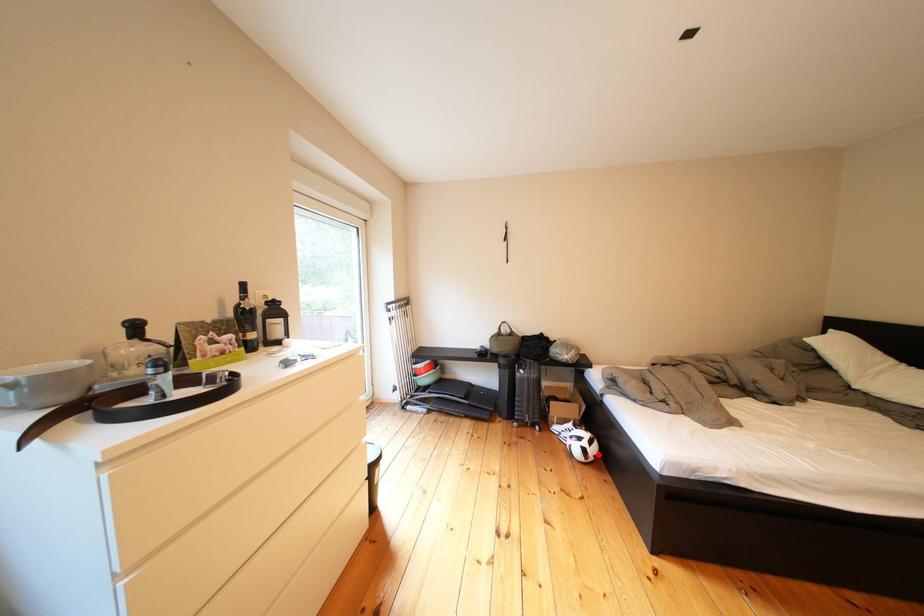
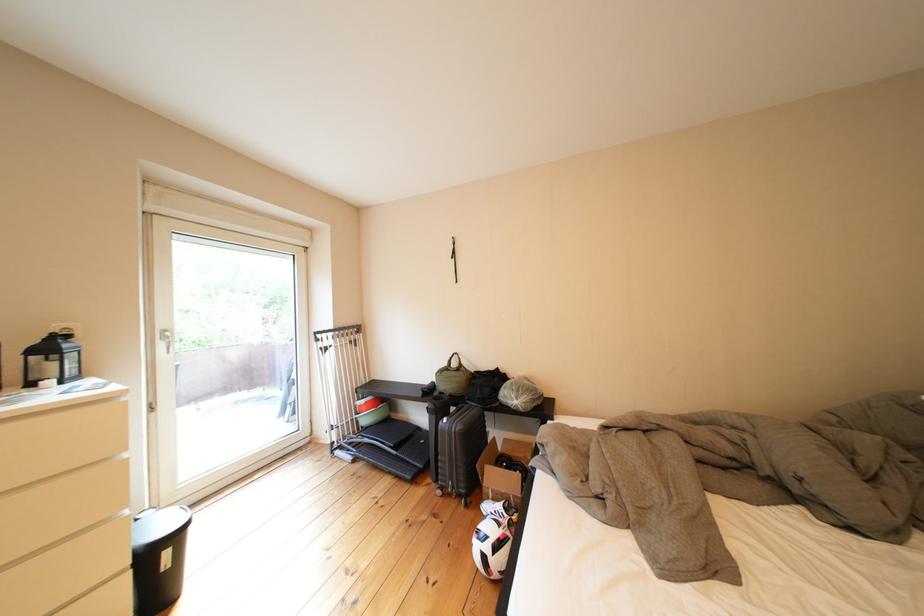
Locate, in the second image, the point that corresponds to the highlighted location in the first image.

(499, 562)